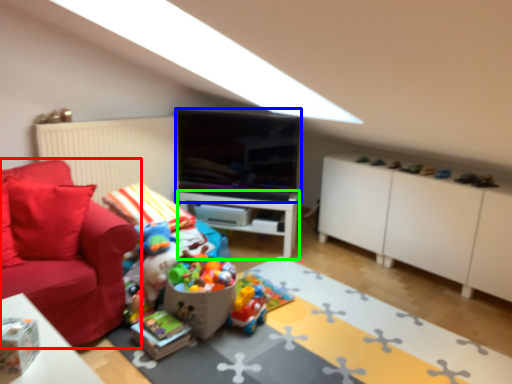
Question: Which object is the farthest from studio couch (highlighted by a red box)? Choose among these: television (highlighted by a blue box) or table (highlighted by a green box).

Choices:
 (A) television
 (B) table

Answer: (B)